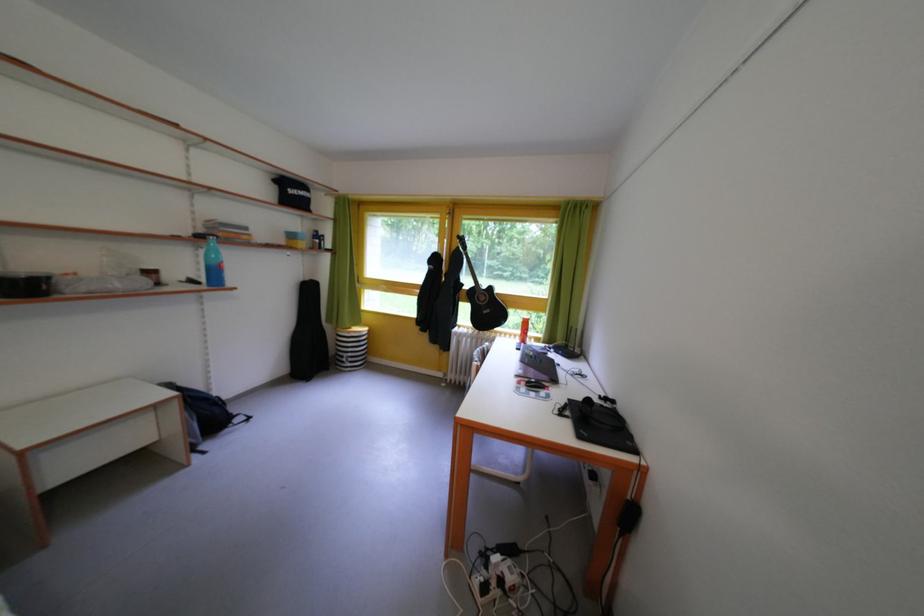
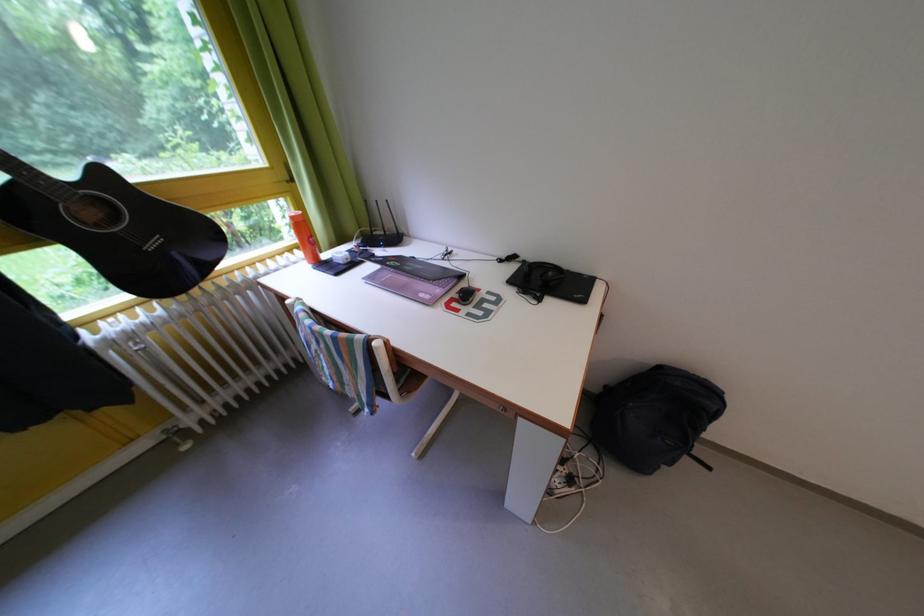
Where in the second image is the point corresponding to (x=556, y=390) from the first image?

(473, 291)